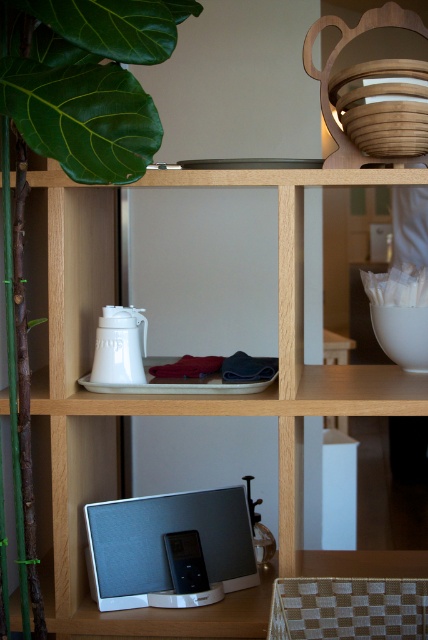
Question: Which object is closer to the camera taking this photo?

Choices:
 (A) silver fabric speaker at lower center
 (B) green leafy plant at upper left

Answer: (B)

Question: Does green leafy plant at upper left appear over silver fabric speaker at lower center?

Choices:
 (A) no
 (B) yes

Answer: (B)

Question: Among these points, which one is farthest from the camera?

Choices:
 (A) (134, 520)
 (B) (41, 125)

Answer: (A)

Question: Does green leafy plant at upper left appear on the left side of silver fabric speaker at lower center?

Choices:
 (A) yes
 (B) no

Answer: (A)

Question: In this image, where is green leafy plant at upper left located relative to silver fabric speaker at lower center?

Choices:
 (A) left
 (B) right

Answer: (A)

Question: Which of the following is the farthest from the observer?

Choices:
 (A) coord(252,576)
 (B) coord(21,488)

Answer: (A)